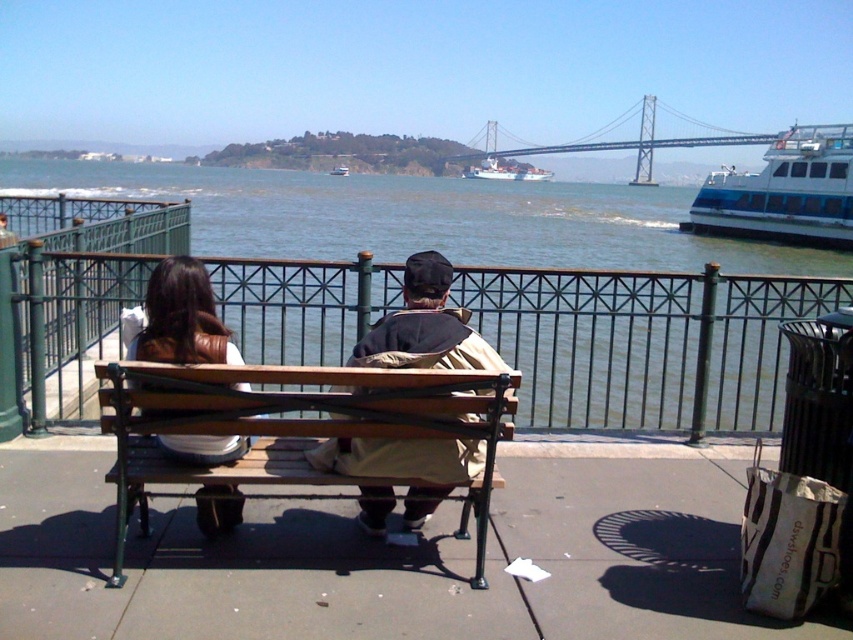
Question: Among these objects, which one is farthest from the camera?

Choices:
 (A) clear water at bench right
 (B) blue metallic ferry at center
 (C) white glossy ship at center

Answer: (C)

Question: Is tan fabric jacket at center positioned at the back of metallic gray bridge at upper center?

Choices:
 (A) yes
 (B) no

Answer: (B)

Question: Can you confirm if brown wooden bench at center is positioned above blue metallic ferry at center?

Choices:
 (A) yes
 (B) no

Answer: (B)

Question: Is clear water at bench right bigger than white glossy ship at center?

Choices:
 (A) yes
 (B) no

Answer: (A)

Question: Which point is closer to the camera?

Choices:
 (A) (531, 196)
 (B) (653, 120)

Answer: (A)

Question: Which object appears closest to the camera in this image?

Choices:
 (A) brown wooden bench at center
 (B) clear water at bench right

Answer: (A)